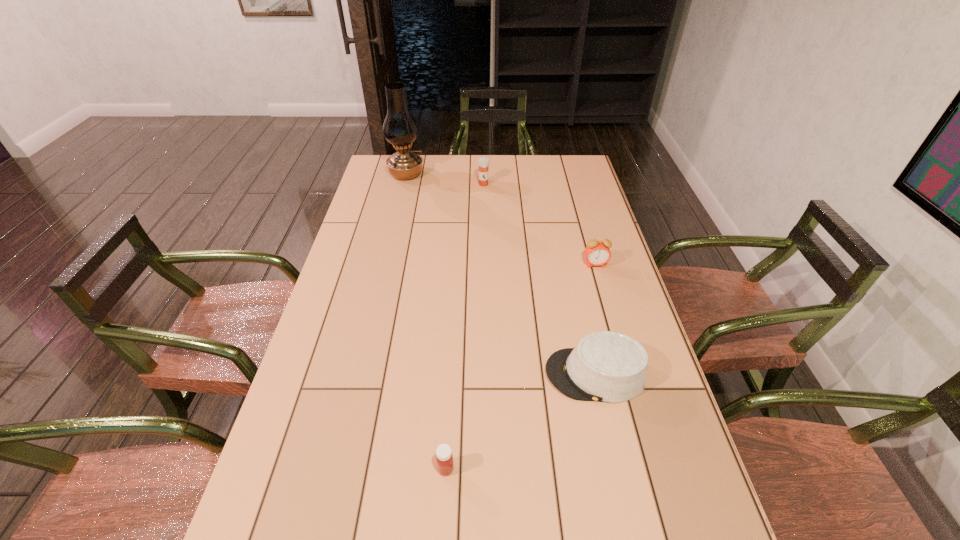
Find the location of a particular element. The height and width of the screenshot is (540, 960). free space located 0.130m on the label side of the third object from right to left is located at coordinates (484, 206).

In order to click on vacant region located on the front-facing side of the hat in this screenshot , I will do `click(472, 374)`.

In order to click on free location located 0.160m on the front-facing side of the hat in this screenshot , I will do `click(480, 374)`.

The width and height of the screenshot is (960, 540). I want to click on vacant area situated 0.310m on the front-facing side of the hat, so click(x=420, y=374).

This screenshot has height=540, width=960. What are the coordinates of `blank space located on the back of the nearest object` in the screenshot? It's located at (453, 338).

Locate an element on the screen. oil lamp located in the far edge section of the desktop is located at coordinates (400, 129).

In order to click on medicine located at the far edge in this screenshot , I will do `click(483, 162)`.

Find the location of a particular element. object that is at the left edge is located at coordinates click(x=400, y=129).

I want to click on alarm clock that is at the right edge, so click(x=597, y=253).

Identify the location of hat present at the right edge. The image size is (960, 540). (605, 366).